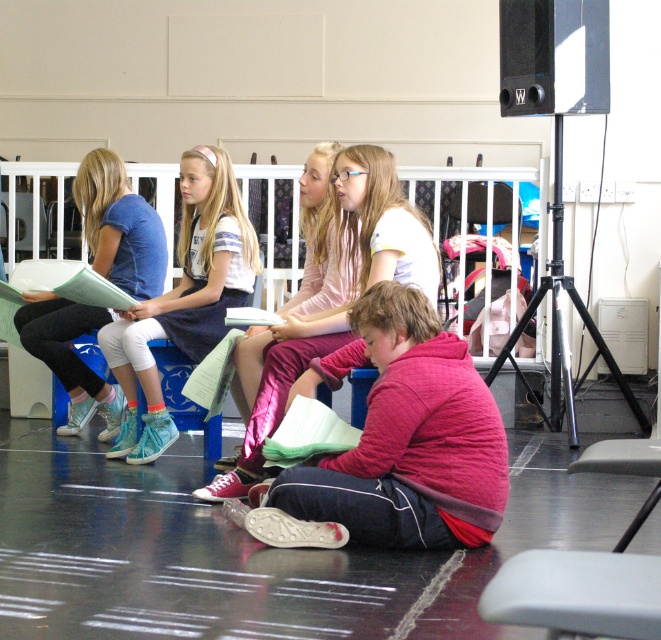
You are a photographer positioned at the back of the stage. You want to capture a closeup of the white fabric shirt at center and the matte blue shirt at left. Which one will appear larger in your photo?

The white fabric shirt at center will appear larger in the photo because it is closer to the viewer than the matte blue shirt at left.

You are a photographer positioned at the back of the stage. You want to capture a photo that includes both the pink quilted jacket at center and the white matte dress at upper left. Which of the two objects should be placed closer to the camera to ensure both are in focus?

The pink quilted jacket at center is already closer to the viewer than the white matte dress at upper left. To ensure both are in focus, position the camera so that the pink quilted jacket at center remains closer, and the white matte dress at upper left is further back. This arrangement maintains their relative positions as described.